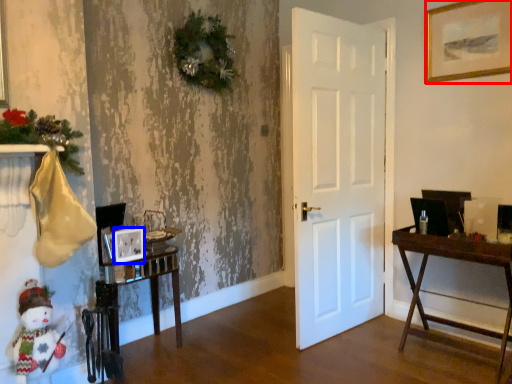
Question: Which of the following is the farthest to the observer, picture frame (highlighted by a red box) or picture frame (highlighted by a blue box)?

Choices:
 (A) picture frame
 (B) picture frame

Answer: (A)